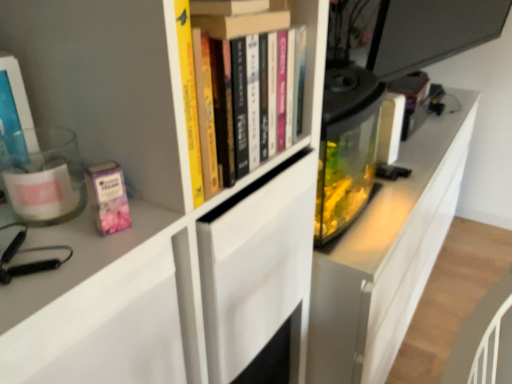
Where is `hardcover books at upper center, positioned as the 1th book in right-to-left order`? hardcover books at upper center, positioned as the 1th book in right-to-left order is located at coordinates (307, 45).

How many degrees apart are the facing directions of translucent plastic container at left, acting as the 1th book starting from the left, and pink matte paperback book at left?

The angular difference between translucent plastic container at left, acting as the 1th book starting from the left, and pink matte paperback book at left is 0.000928 degrees.

Consider the image. Considering the sizes of objects translucent plastic container at left, acting as the 1th book starting from the left, and pink matte paperback book at left in the image provided, who is smaller, translucent plastic container at left, acting as the 1th book starting from the left, or pink matte paperback book at left?

With smaller size is pink matte paperback book at left.

At what (x,y) coordinates should I click in order to perform the action: click on paperback book on the right side of translucent plastic container at left, which is the second book from right to left. Please return your answer as a coordinate pair (x, y). Looking at the image, I should click on (108, 197).

From a real-world perspective, who is located higher, translucent plastic container at left, acting as the 1th book starting from the left, or pink matte paperback book at left?

From a 3D spatial view, translucent plastic container at left, acting as the 1th book starting from the left, is above.

Does translucent plastic container at left, acting as the 1th book starting from the left, have a smaller size compared to hardcover books at upper center, the second book viewed from the left?

Yes.

Image resolution: width=512 pixels, height=384 pixels. In order to click on book that is above the translucent plastic container at left, which is the second book from right to left (from a real-world perspective) in this screenshot , I will do coord(307,45).

Is translucent plastic container at left, acting as the 1th book starting from the left, situated inside hardcover books at upper center, the second book viewed from the left, or outside?

translucent plastic container at left, acting as the 1th book starting from the left, is located beyond the bounds of hardcover books at upper center, the second book viewed from the left.

Considering the relative positions of pink matte paperback book at left and translucent plastic container at left, acting as the 1th book starting from the left, in the image provided, is pink matte paperback book at left to the left of translucent plastic container at left, acting as the 1th book starting from the left, from the viewer's perspective?

In fact, pink matte paperback book at left is to the right of translucent plastic container at left, acting as the 1th book starting from the left.

Is pink matte paperback book at left not within translucent plastic container at left, which is the second book from right to left?

Yes, pink matte paperback book at left is outside of translucent plastic container at left, which is the second book from right to left.

Is pink matte paperback book at left turned away from translucent plastic container at left, acting as the 1th book starting from the left?

No.

Which of these two, pink matte paperback book at left or translucent plastic container at left, which is the second book from right to left, stands shorter?

Standing shorter between the two is pink matte paperback book at left.

From the image's perspective, is hardcover books at upper center, positioned as the 1th book in right-to-left order, located above pink matte paperback book at left?

Indeed, from the image's perspective, hardcover books at upper center, positioned as the 1th book in right-to-left order, is shown above pink matte paperback book at left.

Is point (295, 10) in front of point (115, 176)?

No.

Measure the distance between hardcover books at upper center, the second book viewed from the left, and pink matte paperback book at left.

The distance of hardcover books at upper center, the second book viewed from the left, from pink matte paperback book at left is 11.89 inches.

What's the angular difference between hardcover books at upper center, positioned as the 1th book in right-to-left order, and pink matte paperback book at left's facing directions?

The angular difference between hardcover books at upper center, positioned as the 1th book in right-to-left order, and pink matte paperback book at left is 10.7 degrees.

From the image's perspective, which is above, pink matte paperback book at left or hardcover books at upper center, the second book viewed from the left?

hardcover books at upper center, the second book viewed from the left, is shown above in the image.

Is pink matte paperback book at left positioned with its back to hardcover books at upper center, positioned as the 1th book in right-to-left order?

No, pink matte paperback book at left is not facing away from hardcover books at upper center, positioned as the 1th book in right-to-left order.

From a real-world perspective, count 2nd books upward from the pink matte paperback book at left and point to it. Please provide its 2D coordinates.

[(307, 45)]

Is hardcover books at upper center, the second book viewed from the left, to the left of translucent plastic container at left, acting as the 1th book starting from the left, from the viewer's perspective?

No.

This screenshot has width=512, height=384. In order to click on book above the translucent plastic container at left, acting as the 1th book starting from the left (from the image's perspective) in this screenshot , I will do `click(307, 45)`.

Considering the positions of objects hardcover books at upper center, the second book viewed from the left, and translucent plastic container at left, acting as the 1th book starting from the left, in the image provided, who is behind, hardcover books at upper center, the second book viewed from the left, or translucent plastic container at left, acting as the 1th book starting from the left,?

hardcover books at upper center, the second book viewed from the left, is further away from the camera.

Consider the image. Is hardcover books at upper center, positioned as the 1th book in right-to-left order, oriented towards translucent plastic container at left, which is the second book from right to left?

No, hardcover books at upper center, positioned as the 1th book in right-to-left order, does not turn towards translucent plastic container at left, which is the second book from right to left.

I want to click on book that is the 1st one above the pink matte paperback book at left (from a real-world perspective), so click(x=15, y=114).

Where is `book in front of the hardcover books at upper center, positioned as the 1th book in right-to-left order`? book in front of the hardcover books at upper center, positioned as the 1th book in right-to-left order is located at coordinates (15, 114).

In the scene shown: Looking at the image, which one is located closer to hardcover books at upper center, positioned as the 1th book in right-to-left order, translucent plastic container at left, which is the second book from right to left, or pink matte paperback book at left?

pink matte paperback book at left.

Which object lies further to the anchor point hardcover books at upper center, positioned as the 1th book in right-to-left order, pink matte paperback book at left or translucent plastic container at left, acting as the 1th book starting from the left?

translucent plastic container at left, acting as the 1th book starting from the left.

Estimate the real-world distances between objects in this image. Which object is further from translucent plastic container at left, which is the second book from right to left, hardcover books at upper center, positioned as the 1th book in right-to-left order, or pink matte paperback book at left?

hardcover books at upper center, positioned as the 1th book in right-to-left order, lies further to translucent plastic container at left, which is the second book from right to left, than the other object.

Considering their positions, is pink matte paperback book at left positioned further to translucent plastic container at left, which is the second book from right to left, than hardcover books at upper center, positioned as the 1th book in right-to-left order?

hardcover books at upper center, positioned as the 1th book in right-to-left order, lies further to translucent plastic container at left, which is the second book from right to left, than the other object.

From the image, which object appears to be nearer to pink matte paperback book at left, hardcover books at upper center, the second book viewed from the left, or translucent plastic container at left, which is the second book from right to left?

The object closer to pink matte paperback book at left is translucent plastic container at left, which is the second book from right to left.

Which object lies further to the anchor point pink matte paperback book at left, translucent plastic container at left, which is the second book from right to left, or hardcover books at upper center, positioned as the 1th book in right-to-left order?

hardcover books at upper center, positioned as the 1th book in right-to-left order, lies further to pink matte paperback book at left than the other object.

Image resolution: width=512 pixels, height=384 pixels. What are the coordinates of `paperback book situated between translucent plastic container at left, acting as the 1th book starting from the left, and hardcover books at upper center, positioned as the 1th book in right-to-left order, from left to right` in the screenshot? It's located at (108, 197).